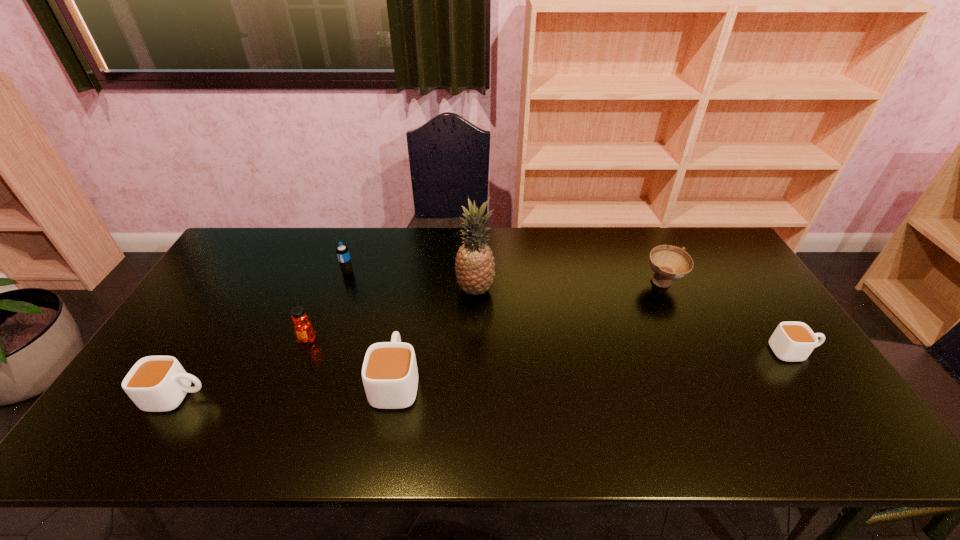
Identify the location of empty space between the honey and the fifth object from right to left. The height and width of the screenshot is (540, 960). (327, 306).

Locate an element on the screen. Image resolution: width=960 pixels, height=540 pixels. vacant region between the sixth object from left to right and the fourth object from right to left is located at coordinates (530, 332).

Where is `blank region between the leftmost cup and the fifth object from left to right`? This screenshot has width=960, height=540. blank region between the leftmost cup and the fifth object from left to right is located at coordinates (326, 343).

The image size is (960, 540). I want to click on free spot between the second cup from right to left and the leftmost cup, so click(287, 389).

Where is `vacant point located between the leftmost cup and the second object from right to left`? The image size is (960, 540). vacant point located between the leftmost cup and the second object from right to left is located at coordinates [420, 340].

The image size is (960, 540). I want to click on unoccupied area between the fourth object from right to left and the sixth object from left to right, so click(530, 332).

You are a GUI agent. You are given a task and a screenshot of the screen. Output one action in this format:
    pyautogui.click(x=<x>, y=<y>)
    Task: Click on the free space between the rightmost object and the honey
    This screenshot has height=540, width=960.
    Given the screenshot: What is the action you would take?
    pyautogui.click(x=550, y=346)

Where is `unoccupied position between the soda bottle and the rightmost object`? unoccupied position between the soda bottle and the rightmost object is located at coordinates (570, 312).

The height and width of the screenshot is (540, 960). What are the coordinates of `the closest object relative to the soup bowl` in the screenshot? It's located at (791, 341).

You are a GUI agent. You are given a task and a screenshot of the screen. Output one action in this format:
    pyautogui.click(x=<x>, y=<y>)
    Task: Click on the object that is the third closest one to the tallest object
    
    Given the screenshot: What is the action you would take?
    pyautogui.click(x=303, y=329)